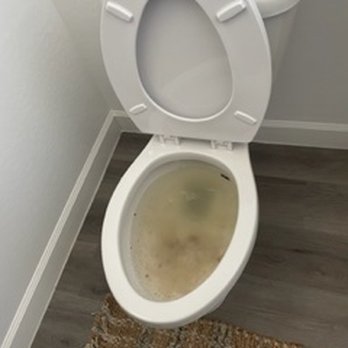
Image resolution: width=348 pixels, height=348 pixels. Identify the location of white walls. (50, 176), (337, 115).